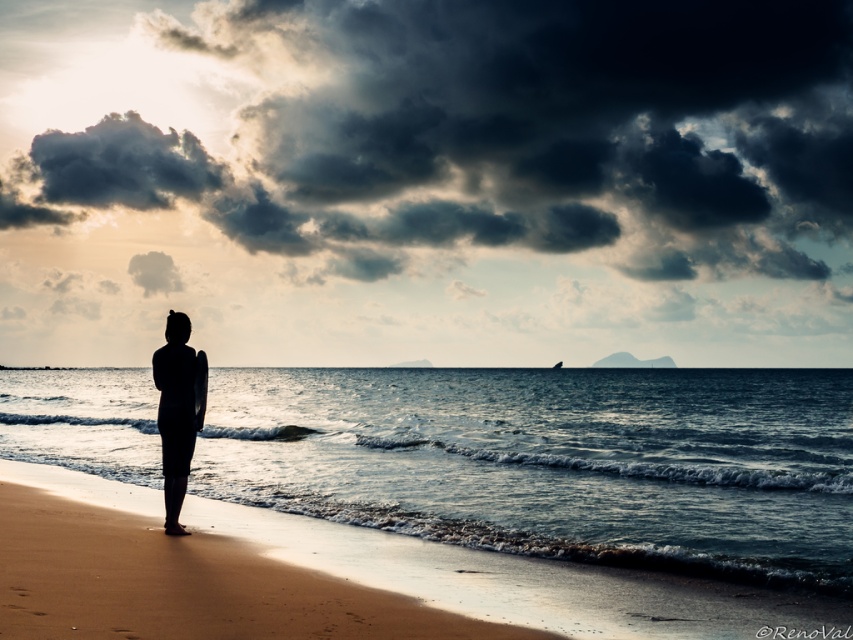
Describe the element at coordinates (184, 584) in the screenshot. I see `sandy beach at lower left` at that location.

Does sandy beach at lower left come behind silhouette surfboard at center?

No.

What are the coordinates of `sandy beach at lower left` in the screenshot? It's located at (184, 584).

Identify the location of sandy beach at lower left. (184, 584).